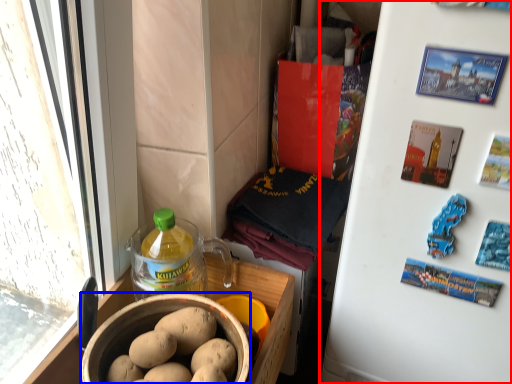
Question: Which point is further to the camera, refrigerator (highlighted by a red box) or bowl (highlighted by a blue box)?

Choices:
 (A) refrigerator
 (B) bowl

Answer: (B)